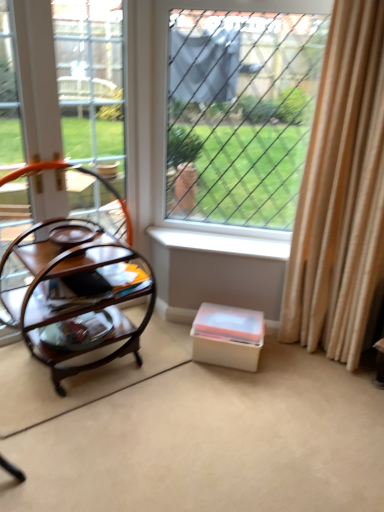
Question: Considering their positions, is beige fabric curtain at right located in front of or behind white plastic storage box at lower center?

Choices:
 (A) front
 (B) behind

Answer: (A)

Question: Considering the positions of beige fabric curtain at right and white plastic storage box at lower center in the image, is beige fabric curtain at right wider or thinner than white plastic storage box at lower center?

Choices:
 (A) wide
 (B) thin

Answer: (A)

Question: Which object is positioned closest to the white plastic storage box at lower center?

Choices:
 (A) beige fabric curtain at right
 (B) wire mesh at center
 (C) wooden frame at left
 (D) white plastic window sill at center
 (E) woodenmaterial/texturetable at left

Answer: (D)

Question: Considering the real-world distances, which object is farthest from the white plastic storage box at lower center?

Choices:
 (A) woodenmaterial/texturetable at left
 (B) beige fabric curtain at right
 (C) white plastic window sill at center
 (D) wire mesh at center
 (E) wooden frame at left

Answer: (E)